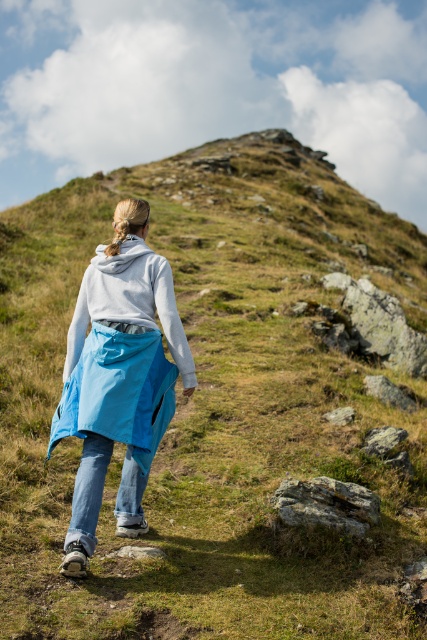
Question: Is denim jeans at lower center closer to camera compared to gray rough rock at lower center?

Choices:
 (A) yes
 (B) no

Answer: (A)

Question: Which point appears closest to the camera in this image?

Choices:
 (A) (119, 376)
 (B) (281, 493)
 (C) (166, 316)
 (D) (116, 392)

Answer: (D)

Question: Does blue waterproof skirt at center appear on the right side of gray rough rock at lower center?

Choices:
 (A) no
 (B) yes

Answer: (A)

Question: Is blue waterproof skirt at center wider than gray rough rock at lower center?

Choices:
 (A) yes
 (B) no

Answer: (B)

Question: Among these objects, which one is nearest to the camera?

Choices:
 (A) gray rough rock at lower center
 (B) matte blue raincoat at center

Answer: (B)

Question: Which of the following is the closest to the observer?

Choices:
 (A) matte blue raincoat at center
 (B) gray rough rock at lower center
 (C) blue waterproof skirt at center

Answer: (A)